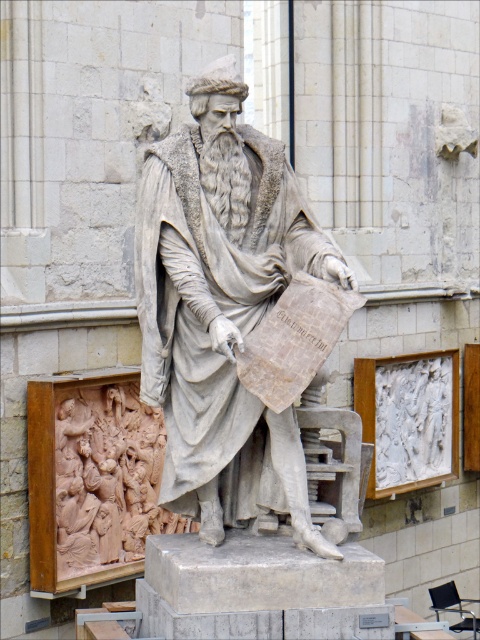
Is point (216, 147) farther from camera compared to point (145, 486)?

No.

Does gray stone statue at center appear on the right side of light brown wood carving at lower left?

Indeed, gray stone statue at center is positioned on the right side of light brown wood carving at lower left.

You are a GUI agent. You are given a task and a screenshot of the screen. Output one action in this format:
    pyautogui.click(x=<x>, y=<y>)
    Task: Click on the gray stone statue at center
    Image resolution: width=480 pixels, height=640 pixels.
    Given the screenshot: What is the action you would take?
    pyautogui.click(x=223, y=308)